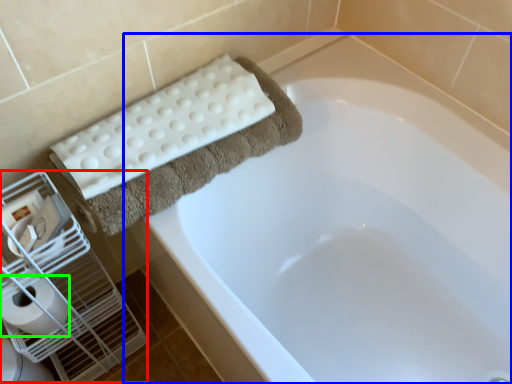
Question: Which object is positioned farthest from bird cage (highlighted by a red box)? Select from bathtub (highlighted by a blue box) and toilet paper (highlighted by a green box).

Choices:
 (A) bathtub
 (B) toilet paper

Answer: (A)